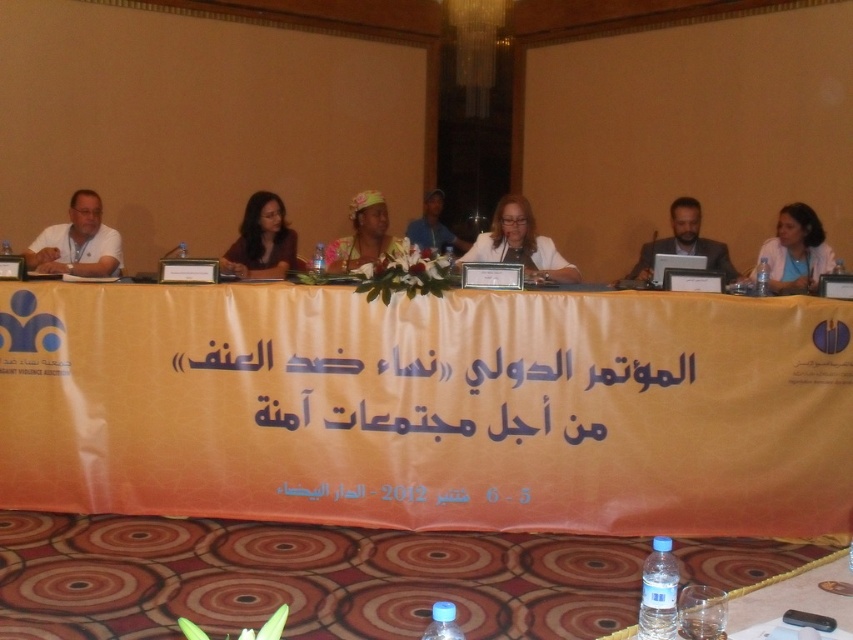
Question: Considering the real-world distances, which object is farthest from the matte white laptop at center?

Choices:
 (A) dark brown hair at center
 (B) orange paper banner at center
 (C) matte yellow headscarf at center

Answer: (A)

Question: Which point is closer to the camera?

Choices:
 (A) (264, 200)
 (B) (399, 516)

Answer: (B)

Question: Can you confirm if orange fabric banner at center is positioned below gray suit at center?

Choices:
 (A) yes
 (B) no

Answer: (A)

Question: Does white fabric at right appear over matte pink dress at center?

Choices:
 (A) no
 (B) yes

Answer: (A)

Question: Where is orange fabric banner at center located in relation to white fabric at right in the image?

Choices:
 (A) below
 (B) above

Answer: (A)

Question: Which of the following is the farthest from the observer?

Choices:
 (A) coord(721,417)
 (B) coord(367,259)
 (C) coord(35,250)

Answer: (C)